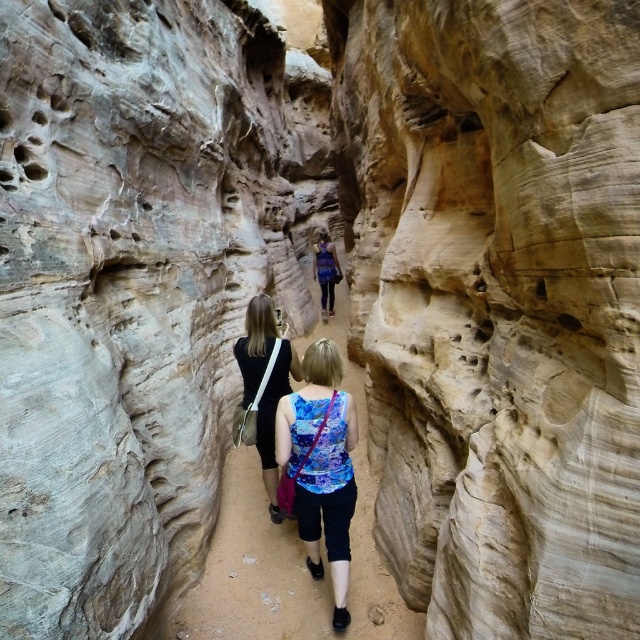
This screenshot has width=640, height=640. I want to click on smooth beige rock at center, so click(x=497, y=304).

Does smooth beige rock at center have a larger size compared to floral fabric tank top at center?

Yes, smooth beige rock at center is bigger than floral fabric tank top at center.

Locate an element on the screen. smooth beige rock at center is located at coordinates (497, 304).

Where is `smooth beige rock at center`? The height and width of the screenshot is (640, 640). smooth beige rock at center is located at coordinates (497, 304).

Between floral fabric tank top at center and matte black dress at center, which one appears on the right side from the viewer's perspective?

From the viewer's perspective, floral fabric tank top at center appears more on the right side.

Who is taller, floral fabric tank top at center or matte black dress at center?

floral fabric tank top at center is taller.

Is point (305, 381) less distant than point (275, 371)?

Yes.

You are a GUI agent. You are given a task and a screenshot of the screen. Output one action in this format:
    pyautogui.click(x=<x>, y=<y>)
    Task: Click on the floral fabric tank top at center
    This screenshot has width=640, height=640.
    Given the screenshot: What is the action you would take?
    click(321, 467)

Between point (209, 595) and point (317, 506), which one is positioned behind?

The point (209, 595) is behind.

Can you confirm if smooth sandstone trail at center is positioned to the right of floral fabric tank top at center?

Correct, you'll find smooth sandstone trail at center to the right of floral fabric tank top at center.

The height and width of the screenshot is (640, 640). Find the location of `smooth sandstone trail at center`. smooth sandstone trail at center is located at coordinates (289, 566).